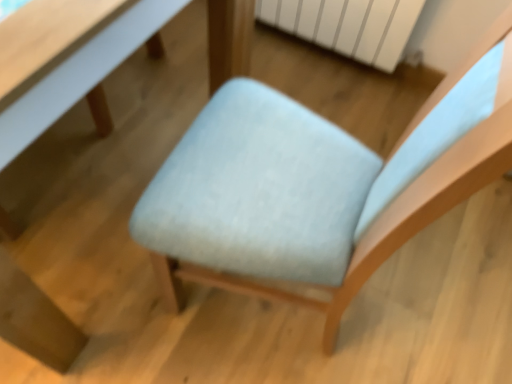
Question: Can you confirm if white glossy table at upper left, acting as the 2th table starting from the left, is positioned to the left of matte light blue table at center, arranged as the 1th table when viewed from the left?

Choices:
 (A) yes
 (B) no

Answer: (B)

Question: From a real-world perspective, is white glossy table at upper left, acting as the 2th table starting from the left, positioned over matte light blue table at center, arranged as the 1th table when viewed from the left, based on gravity?

Choices:
 (A) yes
 (B) no

Answer: (B)

Question: Can you confirm if white glossy table at upper left, acting as the 2th table starting from the left, is smaller than matte light blue table at center, the 2th table viewed from the right?

Choices:
 (A) no
 (B) yes

Answer: (B)

Question: Is white glossy table at upper left, acting as the 2th table starting from the left, positioned beyond the bounds of matte light blue table at center, arranged as the 1th table when viewed from the left?

Choices:
 (A) no
 (B) yes

Answer: (A)

Question: Is white glossy table at upper left, acting as the 2th table starting from the left, to the right of matte light blue table at center, arranged as the 1th table when viewed from the left, from the viewer's perspective?

Choices:
 (A) yes
 (B) no

Answer: (A)

Question: Does white glossy table at upper left, acting as the 2th table starting from the left, contain matte light blue table at center, the 2th table viewed from the right?

Choices:
 (A) no
 (B) yes

Answer: (A)

Question: Does light blue fabric chair at center have a lesser width compared to matte light blue table at center, arranged as the 1th table when viewed from the left?

Choices:
 (A) no
 (B) yes

Answer: (B)

Question: From the image's perspective, is light blue fabric chair at center beneath matte light blue table at center, arranged as the 1th table when viewed from the left?

Choices:
 (A) yes
 (B) no

Answer: (A)

Question: Considering the relative sizes of light blue fabric chair at center and matte light blue table at center, arranged as the 1th table when viewed from the left, in the image provided, is light blue fabric chair at center smaller than matte light blue table at center, arranged as the 1th table when viewed from the left,?

Choices:
 (A) no
 (B) yes

Answer: (B)

Question: Is light blue fabric chair at center oriented away from matte light blue table at center, arranged as the 1th table when viewed from the left?

Choices:
 (A) yes
 (B) no

Answer: (B)

Question: From a real-world perspective, is light blue fabric chair at center positioned over matte light blue table at center, arranged as the 1th table when viewed from the left, based on gravity?

Choices:
 (A) yes
 (B) no

Answer: (A)

Question: Does light blue fabric chair at center have a greater height compared to matte light blue table at center, arranged as the 1th table when viewed from the left?

Choices:
 (A) yes
 (B) no

Answer: (A)

Question: Does white matte radiator at upper center have a lesser width compared to light blue fabric chair at center?

Choices:
 (A) no
 (B) yes

Answer: (B)